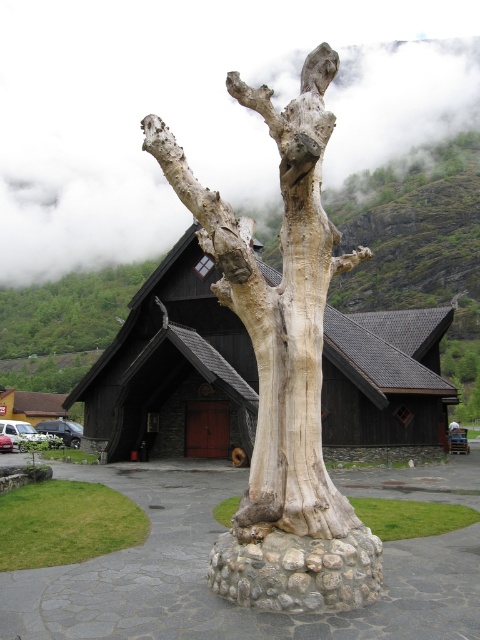
Based on the photo, you are an artist planning to paint the tree trunk. You notice two areas of smooth gray bark at upper center and smooth gray bark at center. Which area should you focus on to capture the widest part of the bark for your painting?

The smooth gray bark at upper center is wider than the smooth gray bark at center, so focusing on the smooth gray bark at upper center will allow you to capture the widest part of the bark for your painting.